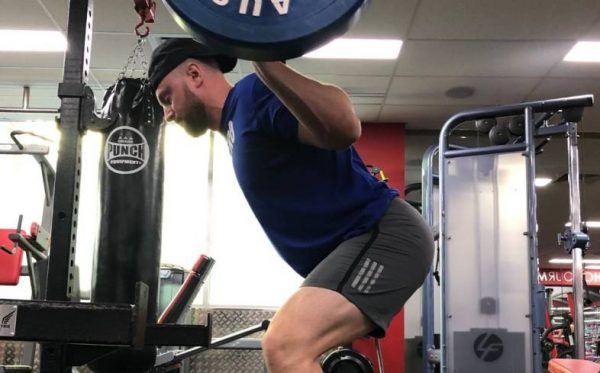
You are a GUI agent. You are given a task and a screenshot of the screen. Output one action in this format:
    pyautogui.click(x=<x>, y=<y>)
    Task: Click on the red seat lower left corner
    This screenshot has height=373, width=600.
    Given the screenshot: What is the action you would take?
    pyautogui.click(x=574, y=370)